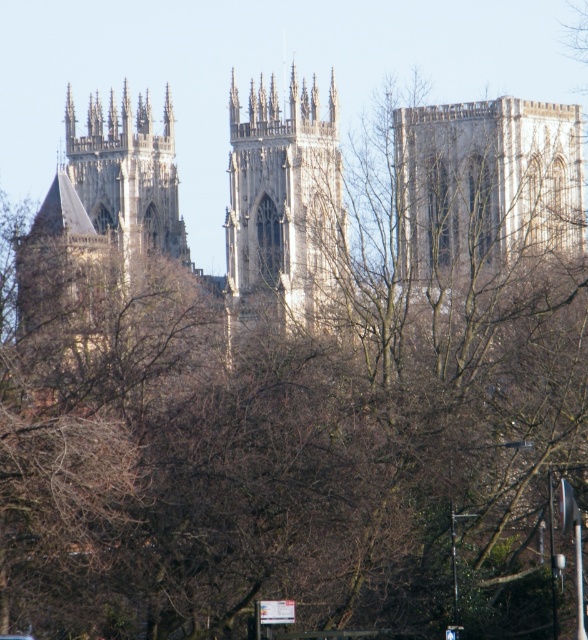
You are standing in front of the cathedral and want to take a photo focusing on the stone gothic tower at left and the stone steeple at left. Which one should you position to the left side of your photo frame to capture both properly?

You should position the stone steeple at left to the left side of your photo frame because the stone gothic tower at left is to the right of the stone steeple at left, so placing the steeple on the left will allow the tower to naturally be on its right within the frame.

You are a tourist standing in front of the cathedral and want to take a photo that includes both the stone tower at upper right and the stone steeple at left. Considering their heights, which one should you focus on to ensure both are fully visible in the frame?

The stone tower at upper right is not as tall as the stone steeple at left, so you should focus on the stone steeple at left to ensure both are fully visible in the frame since it is the taller structure and will help frame the shot appropriately.

You are an architect analyzing the cathedral. Based on the image, which of the two structures, the stone tower at upper right or the stone steeple at left, has a larger size?

The stone tower at upper right is bigger than the stone steeple at left.